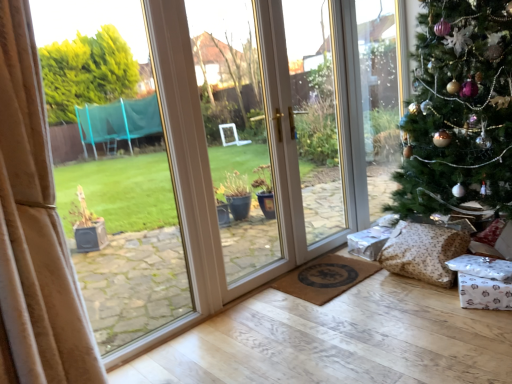
The image size is (512, 384). I want to click on free location above brown textured doormat at lower center (from a real-world perspective), so click(x=329, y=274).